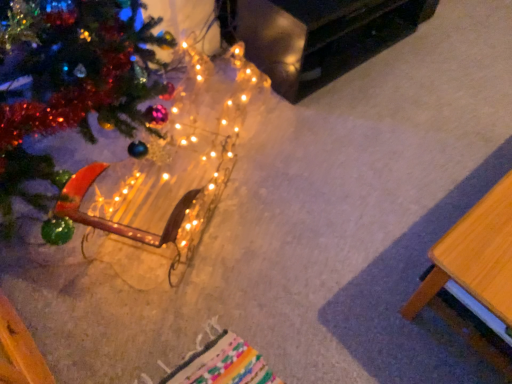
Locate an element on the screen. Image resolution: width=512 pixels, height=384 pixels. vacant space to the right of illuminated wireframe horse at lower left is located at coordinates (332, 178).